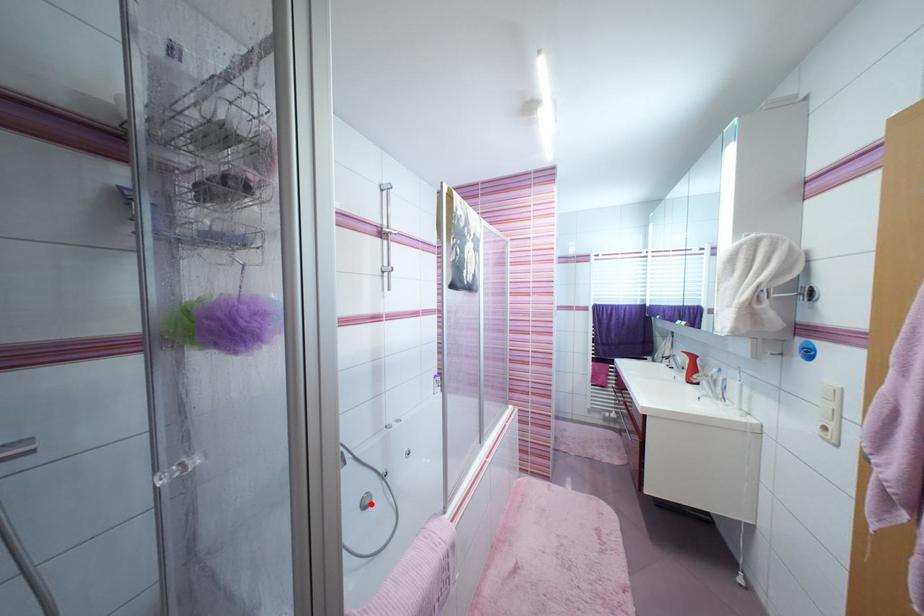
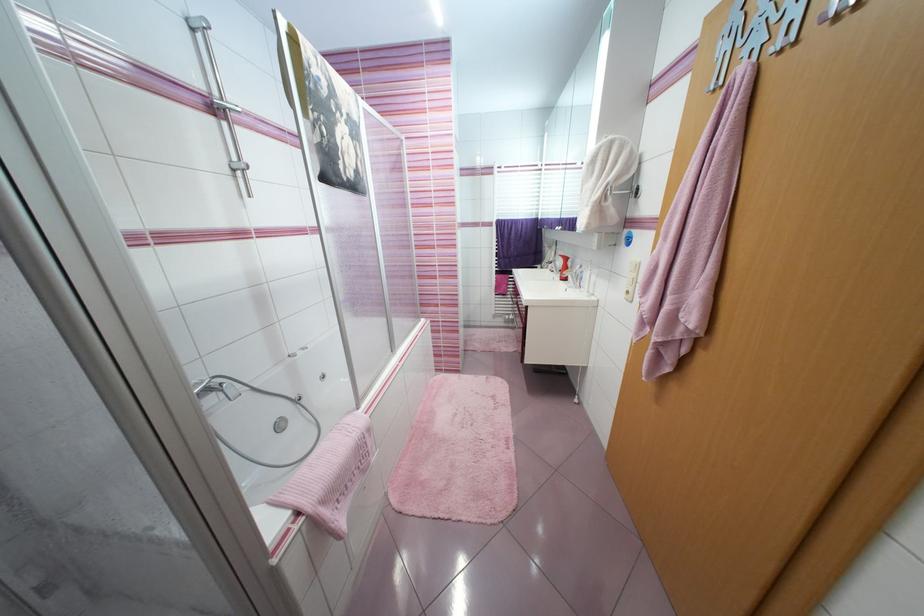
The point at the highlighted location is marked in the first image. Where is the corresponding point in the second image?

(286, 428)